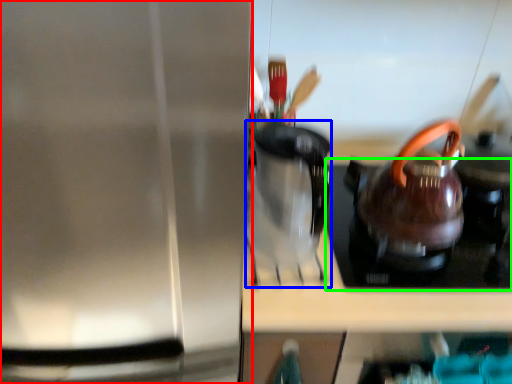
Question: Considering the real-world distances, which object is closest to kitchen appliance (highlighted by a red box)? coffeepot (highlighted by a blue box) or gas stove (highlighted by a green box).

Choices:
 (A) coffeepot
 (B) gas stove

Answer: (A)